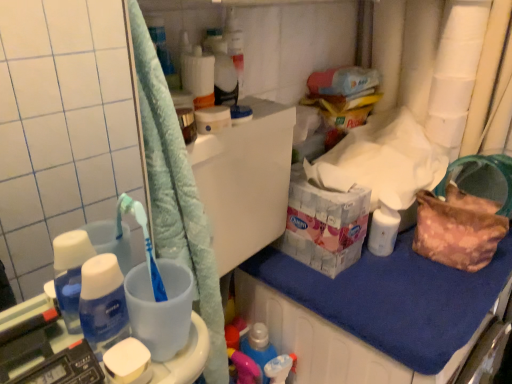
Question: Is black plastic scale at lower left wider or thinner than blue fabric at lower right?

Choices:
 (A) wide
 (B) thin

Answer: (B)

Question: Looking at the image, does black plastic scale at lower left seem bigger or smaller compared to blue fabric at lower right?

Choices:
 (A) small
 (B) big

Answer: (A)

Question: Estimate the real-world distances between objects in this image. Which object is farther from the black plastic scale at lower left?

Choices:
 (A) white matte soap at lower left
 (B) white glossy bottle at right
 (C) blue opaque bottle at lower left
 (D) white matte toilet paper at upper right
 (E) blue fabric at lower right

Answer: (D)

Question: Estimate the real-world distances between objects in this image. Which object is farther from the white glossy bottle at right?

Choices:
 (A) black plastic scale at lower left
 (B) blue fabric at lower right
 (C) blue opaque bottle at lower left
 (D) white matte toilet paper at upper right
 (E) white matte soap at lower left

Answer: (A)